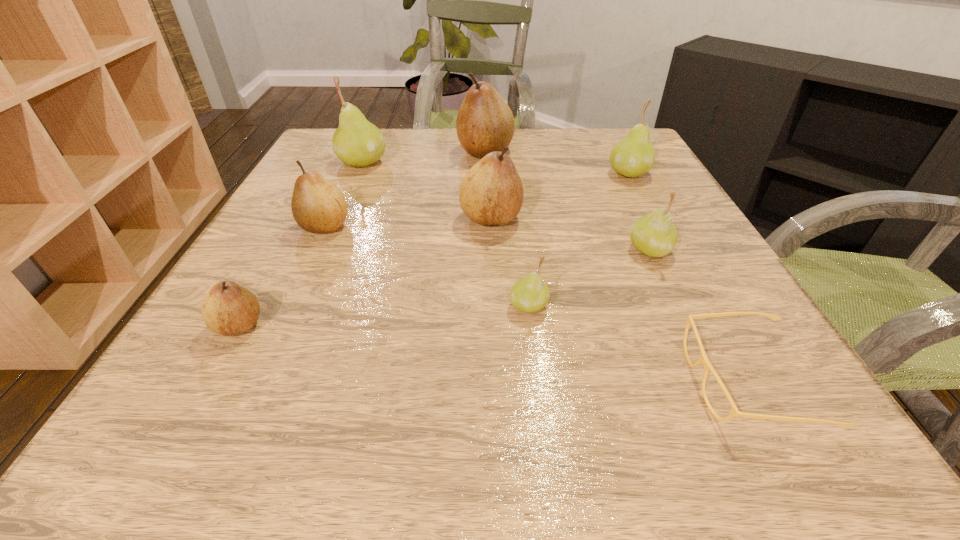
Where is `unoccupied position between the third smallest green pear and the beige spectacles`? The width and height of the screenshot is (960, 540). unoccupied position between the third smallest green pear and the beige spectacles is located at coordinates (688, 278).

Find the location of a particular element. The height and width of the screenshot is (540, 960). free space between the second green pear from left to right and the second biggest brown pear is located at coordinates (510, 262).

Locate an element on the screen. Image resolution: width=960 pixels, height=540 pixels. object that is the sixth closest one to the second green pear from left to right is located at coordinates click(x=633, y=156).

Select which object appears as the third closest to the smallest brown pear. Please provide its 2D coordinates. Your answer should be formatted as a tuple, i.e. [(x, y)], where the tuple contains the x and y coordinates of a point satisfying the conditions above.

[(530, 294)]

Choose which pear is the seventh nearest neighbor to the third biggest brown pear. Please provide its 2D coordinates. Your answer should be formatted as a tuple, i.e. [(x, y)], where the tuple contains the x and y coordinates of a point satisfying the conditions above.

[(633, 156)]

Locate which pear ranks fourth in proximity to the biggest brown pear. Please provide its 2D coordinates. Your answer should be formatted as a tuple, i.e. [(x, y)], where the tuple contains the x and y coordinates of a point satisfying the conditions above.

[(318, 206)]

Where is `brown pear that is the second closest to the third smallest green pear`? This screenshot has width=960, height=540. brown pear that is the second closest to the third smallest green pear is located at coordinates point(491,192).

Locate which brown pear ranks in proximity to the leftmost green pear. Please provide its 2D coordinates. Your answer should be formatted as a tuple, i.e. [(x, y)], where the tuple contains the x and y coordinates of a point satisfying the conditions above.

[(318, 206)]

Where is `green pear that is the second closest to the farthest brown pear`? green pear that is the second closest to the farthest brown pear is located at coordinates (633, 156).

Identify which green pear is located as the third nearest to the third smallest green pear. Please provide its 2D coordinates. Your answer should be formatted as a tuple, i.e. [(x, y)], where the tuple contains the x and y coordinates of a point satisfying the conditions above.

[(357, 142)]